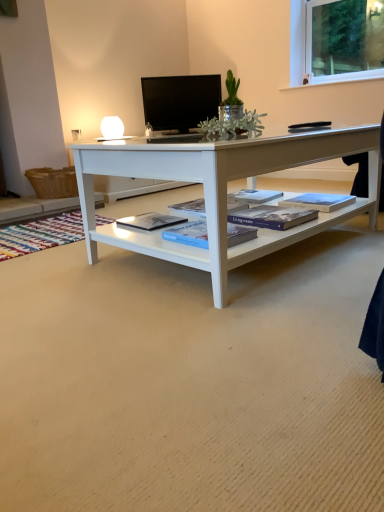
Question: Is blue matte book at center, arranged as the third book when viewed from the right, not close to hardcover book at center, the first book positioned from the left?

Choices:
 (A) no
 (B) yes

Answer: (A)

Question: Can hardcover book at center, the first book positioned from the left, be found inside blue matte book at center, arranged as the third book when viewed from the right?

Choices:
 (A) no
 (B) yes

Answer: (A)

Question: Is blue matte book at center, arranged as the third book when viewed from the right, with hardcover book at center, the first book positioned from the left?

Choices:
 (A) yes
 (B) no

Answer: (B)

Question: From a real-world perspective, does blue matte book at center, arranged as the third book when viewed from the right, stand above hardcover book at center, the 4th book viewed from the right?

Choices:
 (A) yes
 (B) no

Answer: (A)

Question: From the image's perspective, does blue matte book at center, marked as the second book in a left-to-right arrangement, appear lower than hardcover book at center, the 4th book viewed from the right?

Choices:
 (A) yes
 (B) no

Answer: (A)

Question: Considering the positions of blue hardcover book at center, which is the fourth book from left to right, and hardcover book at center, the first book positioned from the left, in the image, is blue hardcover book at center, which is the fourth book from left to right, wider or thinner than hardcover book at center, the first book positioned from the left,?

Choices:
 (A) thin
 (B) wide

Answer: (B)

Question: From a real-world perspective, is blue hardcover book at center, which is the 1th book in right-to-left order, positioned above or below hardcover book at center, the 4th book viewed from the right?

Choices:
 (A) below
 (B) above

Answer: (B)

Question: Do you think blue hardcover book at center, which is the 1th book in right-to-left order, is within hardcover book at center, the first book positioned from the left, or outside of it?

Choices:
 (A) inside
 (B) outside

Answer: (B)

Question: Considering the positions of point (352, 201) and point (148, 223), is point (352, 201) closer or farther from the camera than point (148, 223)?

Choices:
 (A) closer
 (B) farther

Answer: (B)

Question: In the image, is blue matte book at center, arranged as the 3th book when viewed from the left, positioned in front of or behind hardcover book at center, the 4th book viewed from the right?

Choices:
 (A) front
 (B) behind

Answer: (A)

Question: Considering the positions of blue matte book at center, the 2th book when ordered from right to left, and hardcover book at center, the 4th book viewed from the right, in the image, is blue matte book at center, the 2th book when ordered from right to left, taller or shorter than hardcover book at center, the 4th book viewed from the right,?

Choices:
 (A) tall
 (B) short

Answer: (A)

Question: Is blue matte book at center, arranged as the 3th book when viewed from the left, wider or thinner than hardcover book at center, the 4th book viewed from the right?

Choices:
 (A) thin
 (B) wide

Answer: (B)

Question: Is blue matte book at center, the 2th book when ordered from right to left, inside the boundaries of hardcover book at center, the 4th book viewed from the right, or outside?

Choices:
 (A) outside
 (B) inside

Answer: (A)

Question: Is black glossy tv at upper center taller or shorter than hardcover book at center, the first book positioned from the left?

Choices:
 (A) tall
 (B) short

Answer: (A)

Question: In terms of width, does black glossy tv at upper center look wider or thinner when compared to hardcover book at center, the 4th book viewed from the right?

Choices:
 (A) thin
 (B) wide

Answer: (A)